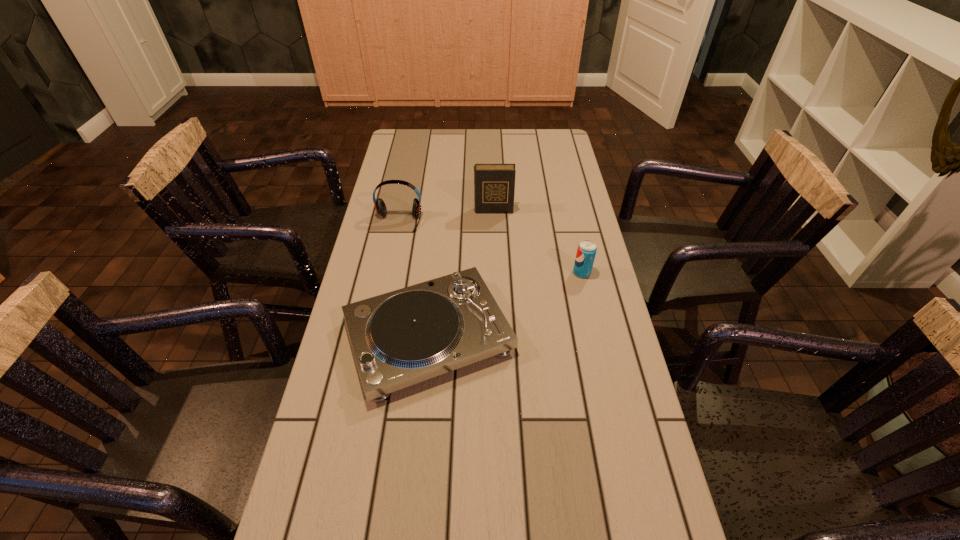
This screenshot has width=960, height=540. What are the coordinates of `vacant region that satisfies the following two spatial constraints: 1. with the microphone attached to the side of the rightmost object; 2. on the left side of the headset` in the screenshot? It's located at (388, 273).

This screenshot has width=960, height=540. What are the coordinates of `vacant area that satisfies the following two spatial constraints: 1. with the microphone attached to the side of the second shortest object; 2. on the left side of the headset` in the screenshot? It's located at (388, 273).